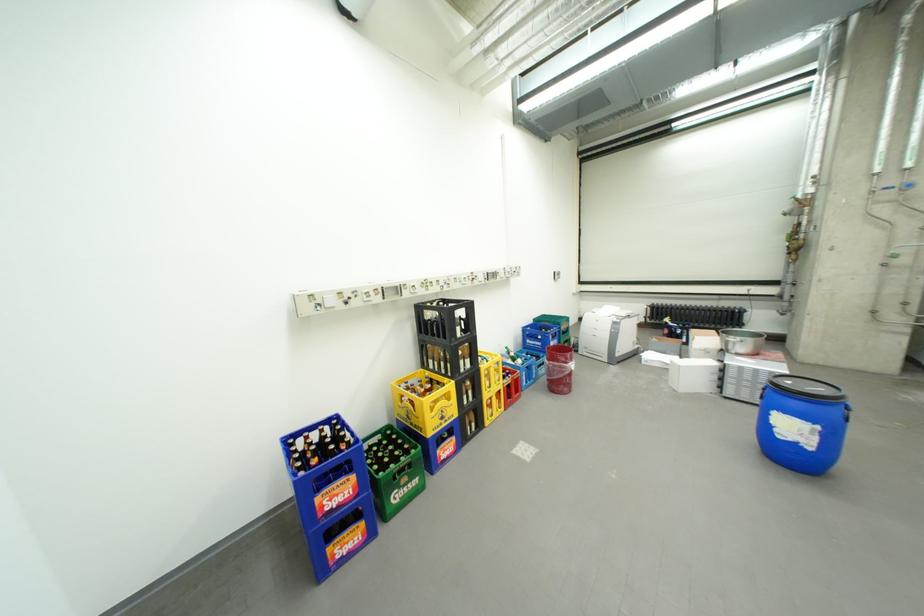
Locate an element on the screen. Image resolution: width=924 pixels, height=616 pixels. black barrel lid is located at coordinates (807, 387).